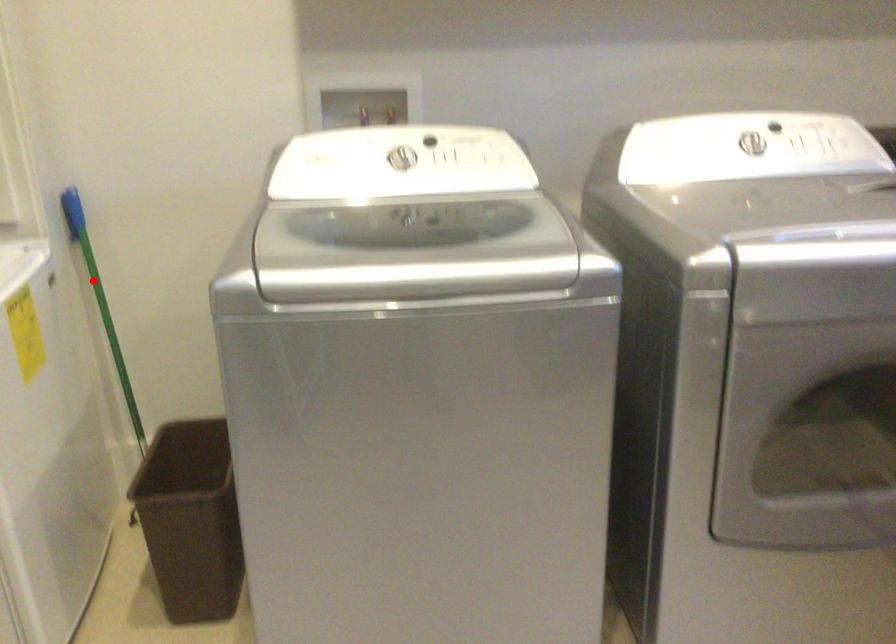
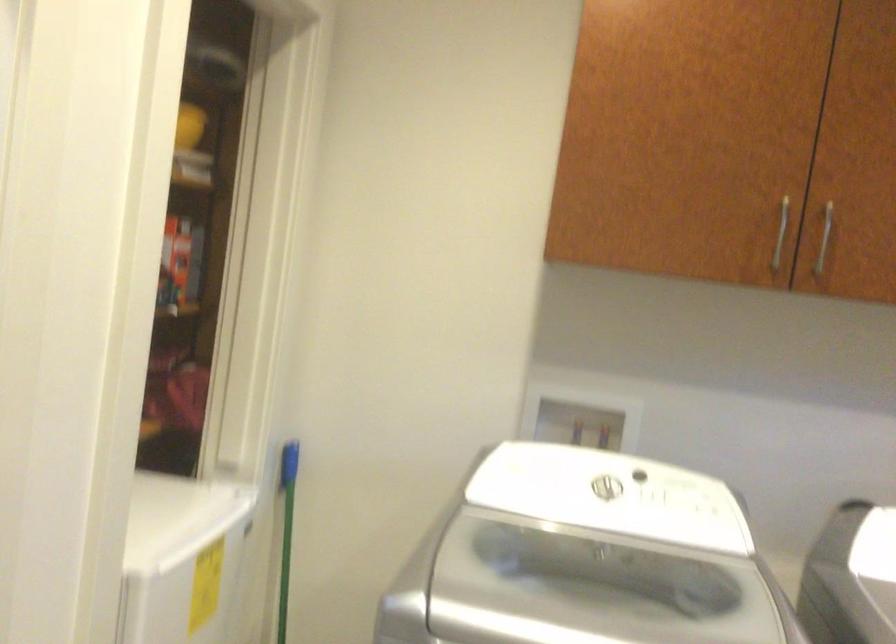
In the second image, find the point that corresponds to the highlighted location in the first image.

(286, 529)